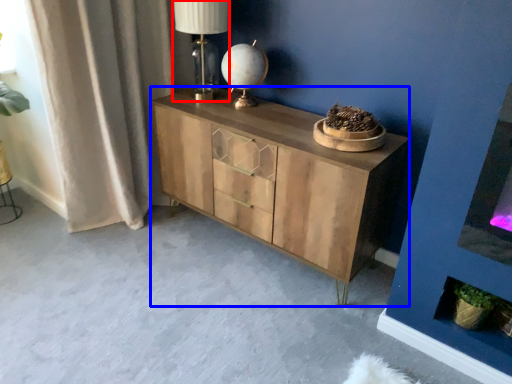
Question: Which point is further to the camera, table lamp (highlighted by a red box) or chest of drawers (highlighted by a blue box)?

Choices:
 (A) table lamp
 (B) chest of drawers

Answer: (A)